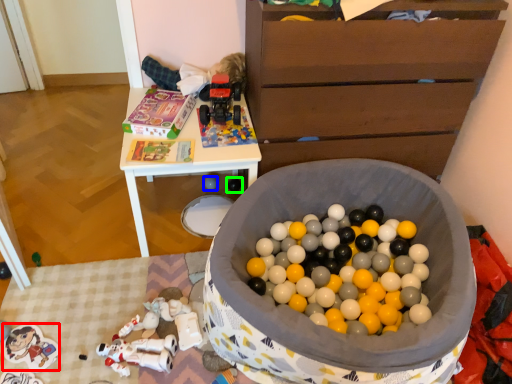
Question: Estimate the real-world distances between objects in this image. Which object is closer to toy (highlighted by a red box), toy (highlighted by a blue box) or toy (highlighted by a green box)?

Choices:
 (A) toy
 (B) toy

Answer: (A)